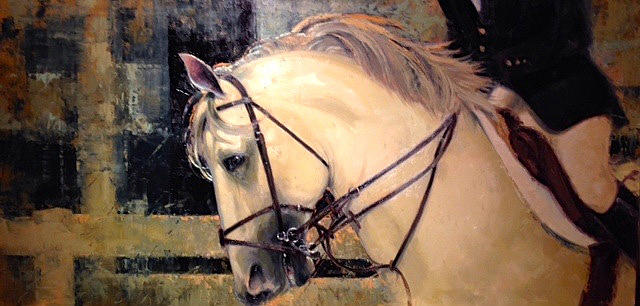
At what (x,y) coordinates should I click in order to perform the action: click on painting. Please return your answer as a coordinate pair (x, y). This screenshot has width=640, height=306. Looking at the image, I should click on (376, 139).